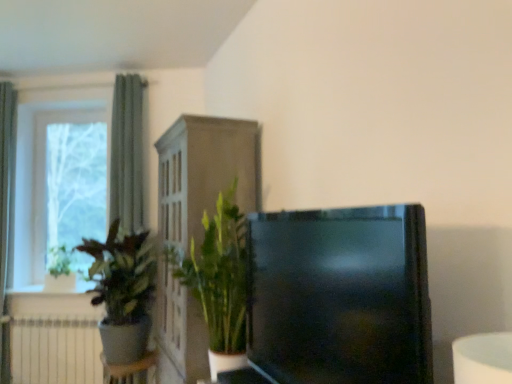
Question: Can you confirm if green fabric curtain at left, positioned as the second curtain in left-to-right order, is taller than white matte radiator at lower left?

Choices:
 (A) yes
 (B) no

Answer: (A)

Question: Is green fabric curtain at left, positioned as the second curtain in left-to-right order, wider than white matte radiator at lower left?

Choices:
 (A) no
 (B) yes

Answer: (B)

Question: Considering the relative sizes of green fabric curtain at left, the 1th curtain when ordered from right to left, and white matte radiator at lower left in the image provided, is green fabric curtain at left, the 1th curtain when ordered from right to left, shorter than white matte radiator at lower left?

Choices:
 (A) no
 (B) yes

Answer: (A)

Question: From a real-world perspective, is green fabric curtain at left, positioned as the second curtain in left-to-right order, physically above white matte radiator at lower left?

Choices:
 (A) no
 (B) yes

Answer: (B)

Question: Is green fabric curtain at left, the 1th curtain when ordered from right to left, oriented towards white matte radiator at lower left?

Choices:
 (A) no
 (B) yes

Answer: (A)

Question: Which is correct: white matte radiator at lower left is inside white glossy window sill at lower left, or outside of it?

Choices:
 (A) outside
 (B) inside

Answer: (A)

Question: From a real-world perspective, is white matte radiator at lower left above or below white glossy window sill at lower left?

Choices:
 (A) below
 (B) above

Answer: (A)

Question: Is white matte radiator at lower left wider or thinner than white glossy window sill at lower left?

Choices:
 (A) wide
 (B) thin

Answer: (B)

Question: Is point (48, 364) positioned closer to the camera than point (15, 291)?

Choices:
 (A) closer
 (B) farther

Answer: (A)

Question: From a real-world perspective, is white glossy window sill at lower left physically located above or below green matte plant at left, acting as the 2th houseplant starting from the right?

Choices:
 (A) below
 (B) above

Answer: (A)

Question: Is point (44, 286) positioned closer to the camera than point (129, 273)?

Choices:
 (A) farther
 (B) closer

Answer: (A)

Question: Looking at their shapes, would you say white glossy window sill at lower left is wider or thinner than green matte plant at left, placed as the 1th houseplant when sorted from left to right?

Choices:
 (A) thin
 (B) wide

Answer: (A)

Question: From the image's perspective, relative to green matte plant at left, acting as the 2th houseplant starting from the right, is white glossy window sill at lower left above or below?

Choices:
 (A) below
 (B) above

Answer: (A)

Question: Do you think green leafy plant at center, arranged as the first houseplant when viewed from the right, is within white glossy window sill at lower left, or outside of it?

Choices:
 (A) inside
 (B) outside

Answer: (B)

Question: In the image, is green leafy plant at center, positioned as the second houseplant in left-to-right order, positioned in front of or behind white glossy window sill at lower left?

Choices:
 (A) behind
 (B) front

Answer: (B)